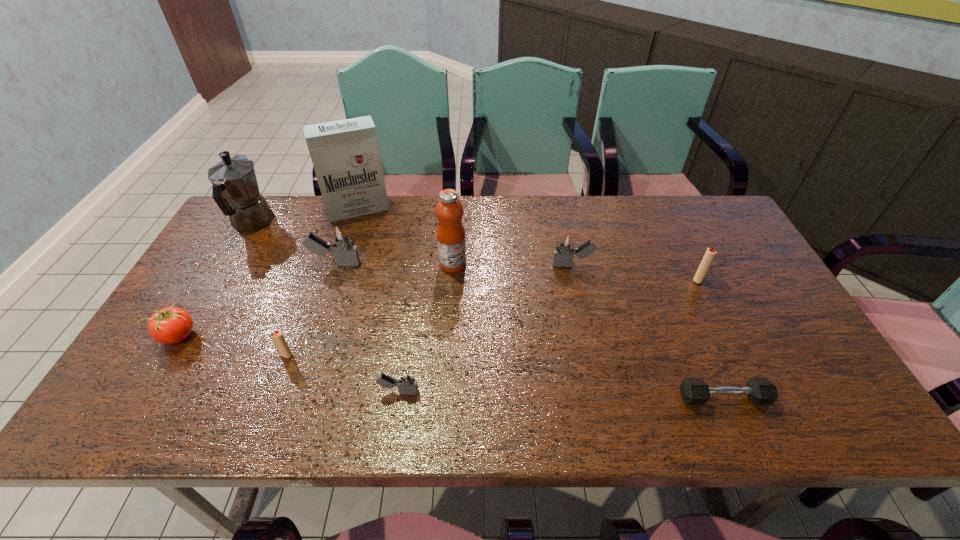
In order to click on the tallest object in this screenshot , I will do `click(345, 154)`.

Where is `coffeepot`? The width and height of the screenshot is (960, 540). coffeepot is located at coordinates (235, 189).

This screenshot has width=960, height=540. I want to click on the fourth object from right to left, so [450, 233].

The height and width of the screenshot is (540, 960). I want to click on fruit juice, so click(450, 233).

You are a GUI agent. You are given a task and a screenshot of the screen. Output one action in this format:
    pyautogui.click(x=<x>, y=<y>)
    Task: Click on the leftmost gray igniter
    This screenshot has width=960, height=540.
    Given the screenshot: What is the action you would take?
    pyautogui.click(x=341, y=243)

I want to click on the biggest gray igniter, so click(x=341, y=243).

This screenshot has height=540, width=960. I want to click on the second smallest gray igniter, so click(x=562, y=256).

The width and height of the screenshot is (960, 540). Find the location of `the eighth object from left to right`. the eighth object from left to right is located at coordinates (562, 256).

This screenshot has height=540, width=960. Find the location of `the farther red igniter`. the farther red igniter is located at coordinates (709, 256).

At what (x,y) coordinates should I click in order to perform the action: click on the third farthest igniter. Please return your answer as a coordinate pair (x, y). This screenshot has width=960, height=540. Looking at the image, I should click on (709, 256).